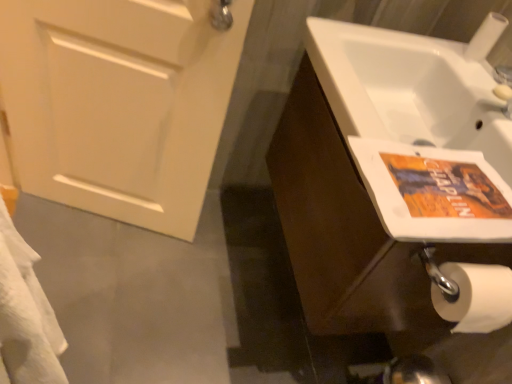
Identify the location of free point in front of white matte toilet paper at lower right. (477, 80).